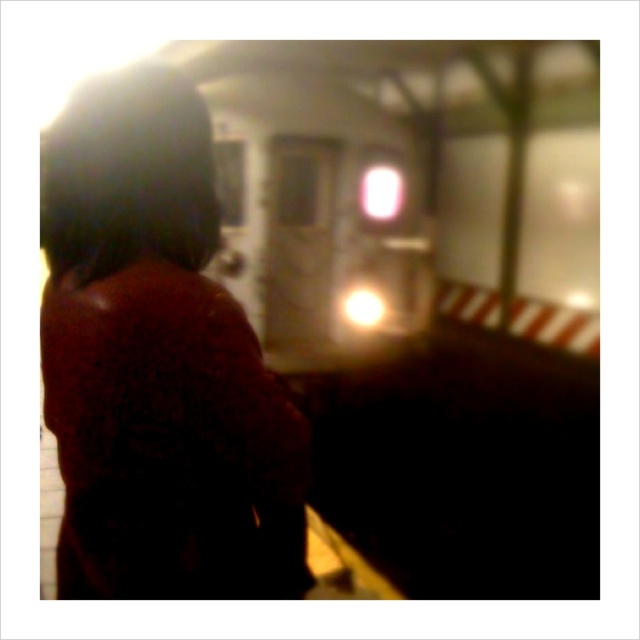
Question: Is dark brown fur coat at upper left in front of metallic silver train at center?

Choices:
 (A) no
 (B) yes

Answer: (B)

Question: Can you confirm if dark brown fur coat at upper left is thinner than metallic silver train at center?

Choices:
 (A) no
 (B) yes

Answer: (B)

Question: Does dark brown fur coat at upper left appear under metallic silver train at center?

Choices:
 (A) no
 (B) yes

Answer: (B)